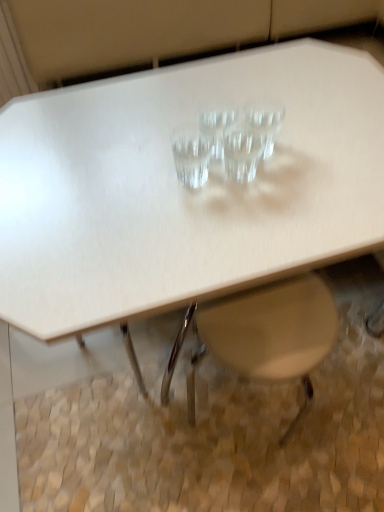
Find the location of `empty space that is to the right of white plastic swivel chair at lower center`. empty space that is to the right of white plastic swivel chair at lower center is located at coordinates (319, 432).